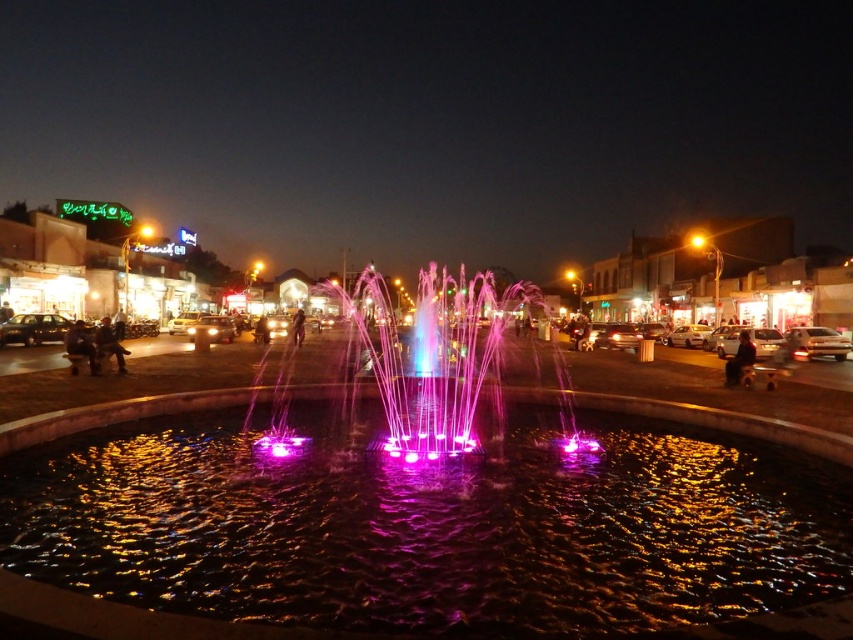
Question: Among these points, which one is nearest to the camera?

Choices:
 (A) (403, 429)
 (B) (231, 388)

Answer: (A)

Question: Is purple illuminated water at center behind multicolored illuminated water at center?

Choices:
 (A) no
 (B) yes

Answer: (A)

Question: Which point is closer to the camera?

Choices:
 (A) (355, 296)
 (B) (149, 611)

Answer: (B)

Question: Observing the image, what is the correct spatial positioning of purple illuminated water at center in reference to multicolored illuminated water at center?

Choices:
 (A) below
 (B) above

Answer: (A)

Question: Does purple illuminated water at center have a smaller size compared to multicolored illuminated water at center?

Choices:
 (A) yes
 (B) no

Answer: (A)